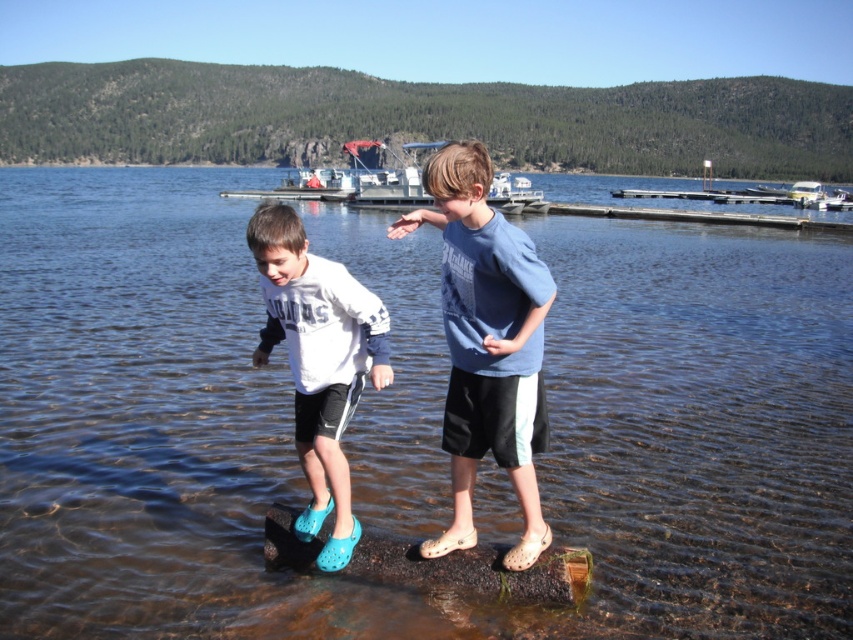
You are a photographer trying to capture a closeup shot of the blue cotton shirt at center and the white matte sneakers at center. Which object should you zoom in more on to ensure both are in focus?

Since the blue cotton shirt at center is narrower than the white matte sneakers at center, you should zoom in more on the blue cotton shirt at center to ensure both are in focus.

You are planning to take a photo of the clear water at center and the white plastic boat at upper right. Which object should you focus on first if you want to capture both in the same frame without moving the camera?

The clear water at center is much taller than the white plastic boat at upper right, so you should focus on the clear water at center first to ensure both are in the frame.

You are a photographer trying to capture a closeup shot of the blue cotton shirt at center and the white matte sneakers at center. Given that your camera has a minimum focusing distance of 35 inches, will you be able to take the photo without moving closer?

The blue cotton shirt at center is 34.59 inches from the white matte sneakers at center, which is within the camera minimum focusing distance of 35 inches. Therefore, you can take the photo without moving closer.